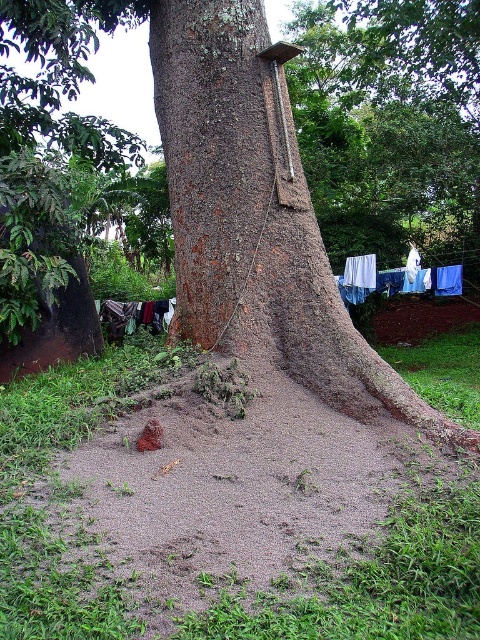
Question: Does blue fabric clothes at lower right appear on the right side of dark blue fabric at lower left?

Choices:
 (A) yes
 (B) no

Answer: (A)

Question: Which object is the closest to the dark blue fabric at lower left?

Choices:
 (A) blue fabric clothes at lower right
 (B) white fabric at lower right

Answer: (B)

Question: Is brown rough tree trunk at center to the left of white fabric at lower right from the viewer's perspective?

Choices:
 (A) yes
 (B) no

Answer: (A)

Question: Can you confirm if blue fabric clothes at lower right is bigger than white fabric at lower right?

Choices:
 (A) no
 (B) yes

Answer: (B)

Question: Estimate the real-world distances between objects in this image. Which object is closer to the dark blue fabric at lower left?

Choices:
 (A) white fabric at lower right
 (B) brown rough tree trunk at center
 (C) blue fabric clothes at lower right

Answer: (A)

Question: Considering the real-world distances, which object is closest to the dark blue fabric at lower left?

Choices:
 (A) blue fabric clothes at lower right
 (B) white fabric at lower right

Answer: (B)